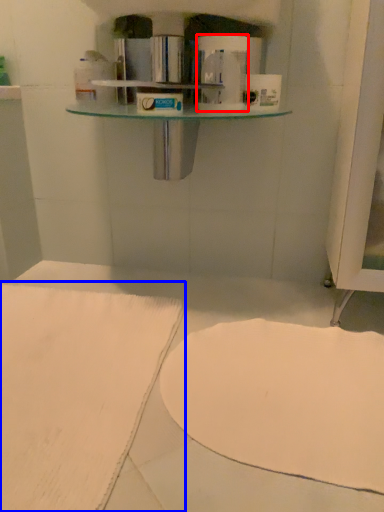
Question: Which point is closer to the camera, toilet paper (highlighted by a red box) or sheet (highlighted by a blue box)?

Choices:
 (A) toilet paper
 (B) sheet

Answer: (B)